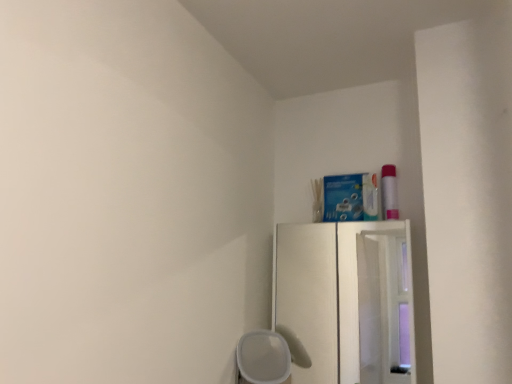
Question: Considering the positions of white matte cup at lower center and white wood cabinet at upper right in the image, is white matte cup at lower center bigger or smaller than white wood cabinet at upper right?

Choices:
 (A) small
 (B) big

Answer: (B)

Question: In the image, is white matte cup at lower center on the left side or the right side of white wood cabinet at upper right?

Choices:
 (A) left
 (B) right

Answer: (A)

Question: Is point (249, 339) closer or farther from the camera than point (333, 261)?

Choices:
 (A) closer
 (B) farther

Answer: (A)

Question: Considering the positions of white wood cabinet at upper right and white matte cup at lower center in the image, is white wood cabinet at upper right wider or thinner than white matte cup at lower center?

Choices:
 (A) wide
 (B) thin

Answer: (B)

Question: From a real-world perspective, is white wood cabinet at upper right above or below white matte cup at lower center?

Choices:
 (A) below
 (B) above

Answer: (B)

Question: Is white wood cabinet at upper right inside the boundaries of white matte cup at lower center, or outside?

Choices:
 (A) inside
 (B) outside

Answer: (B)

Question: From the image's perspective, is white wood cabinet at upper right positioned above or below white matte cup at lower center?

Choices:
 (A) above
 (B) below

Answer: (A)